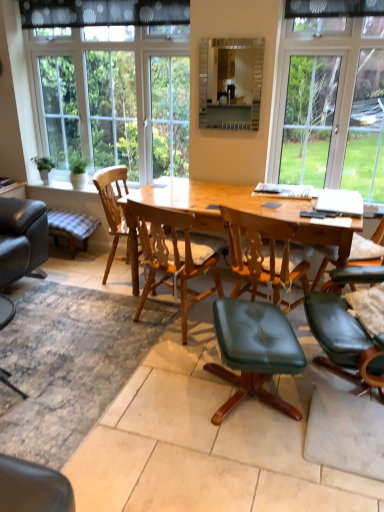
Identify the location of vacant space situated on the left part of green leather stool at center, which is counted as the third chair, starting from the back. (155, 393).